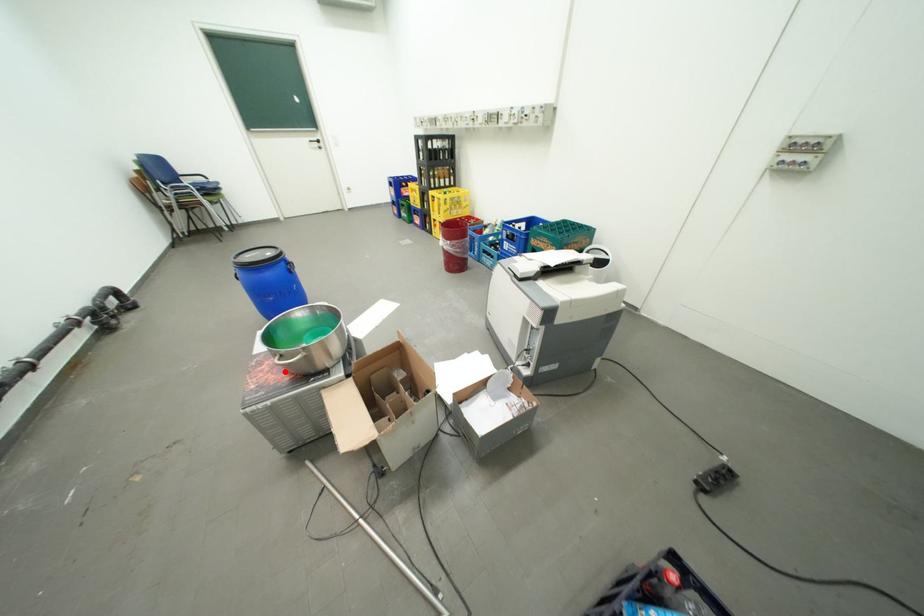
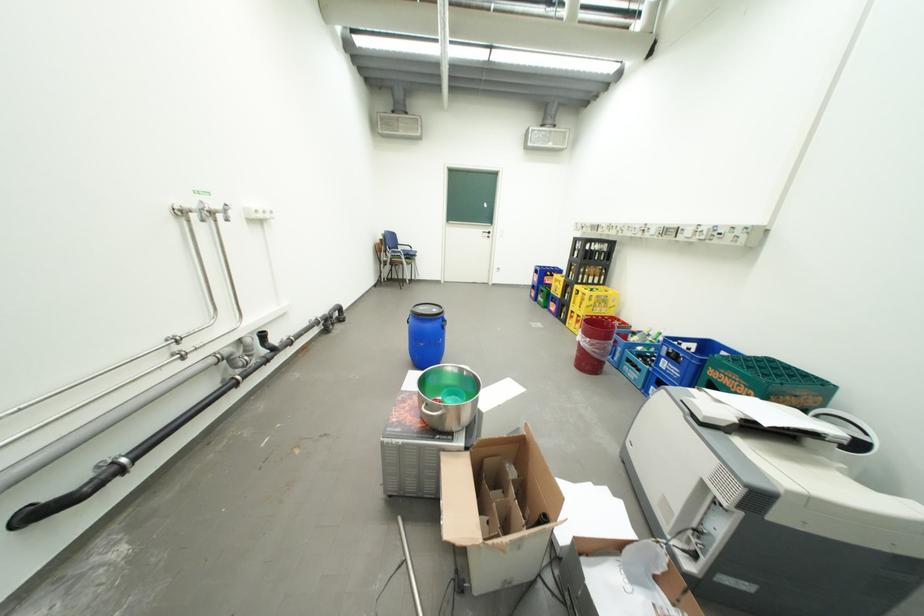
The point at the highlighted location is marked in the first image. Where is the corresponding point in the second image?

(422, 414)